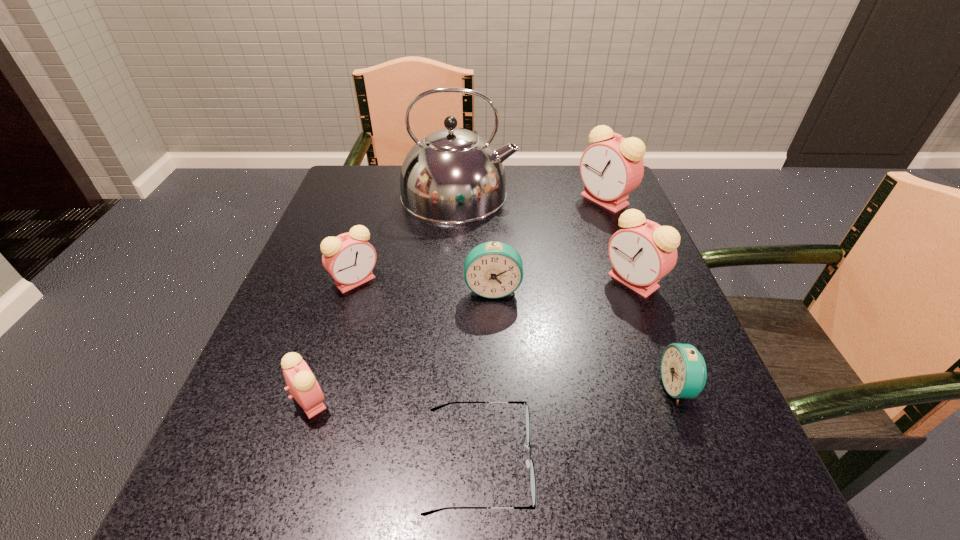
Where is `the tallest object`? This screenshot has width=960, height=540. the tallest object is located at coordinates (452, 175).

Identify the location of the tallest alarm clock. (610, 169).

The image size is (960, 540). I want to click on the seventh shortest object, so click(610, 169).

Identify the location of the third smallest pink alarm clock. Image resolution: width=960 pixels, height=540 pixels. (642, 252).

What are the coordinates of `the third tallest object` in the screenshot? It's located at (642, 252).

Identify the location of the third biggest pink alarm clock. The width and height of the screenshot is (960, 540). (349, 258).

You are a GUI agent. You are given a task and a screenshot of the screen. Output one action in this format:
    pyautogui.click(x=<x>, y=<y>)
    Task: Click on the left blue alarm clock
    The width and height of the screenshot is (960, 540).
    Given the screenshot: What is the action you would take?
    pyautogui.click(x=493, y=269)

Locate an element on the screen. This screenshot has height=540, width=960. the fourth alarm clock from right to left is located at coordinates (493, 269).

Where is `the smaller blue alarm clock`? The image size is (960, 540). the smaller blue alarm clock is located at coordinates (683, 370).

Find the location of a particular element. This screenshot has height=540, width=960. the right blue alarm clock is located at coordinates (683, 370).